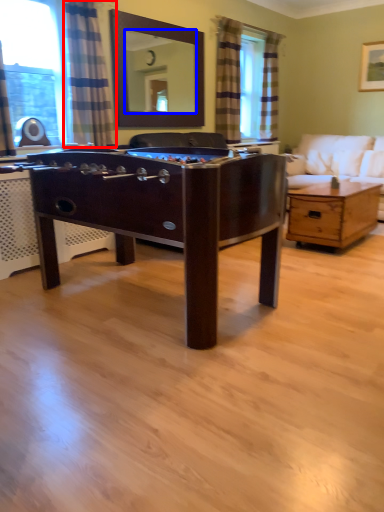
Question: Which object appears closest to the camera in this image, curtain (highlighted by a red box) or mirror (highlighted by a blue box)?

Choices:
 (A) curtain
 (B) mirror

Answer: (A)